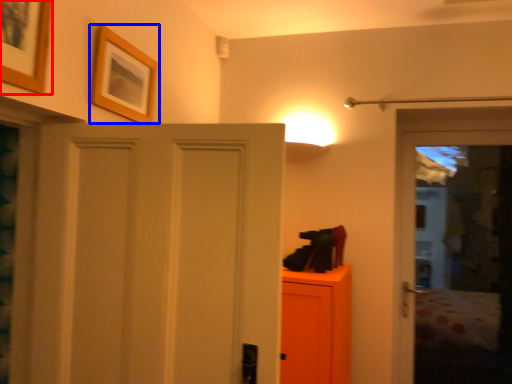
Question: Which of the following is the farthest to the observer, picture frame (highlighted by a red box) or picture frame (highlighted by a blue box)?

Choices:
 (A) picture frame
 (B) picture frame

Answer: (B)